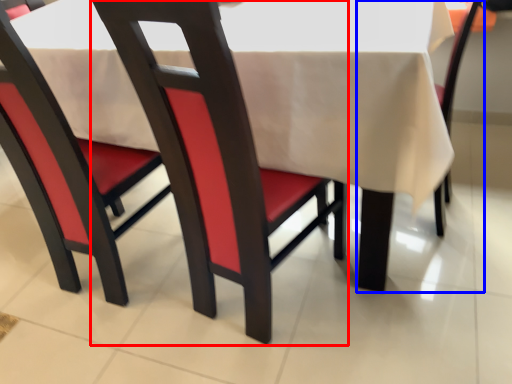
Question: Among these objects, which one is farthest to the camera, chair (highlighted by a red box) or chair (highlighted by a blue box)?

Choices:
 (A) chair
 (B) chair

Answer: (B)